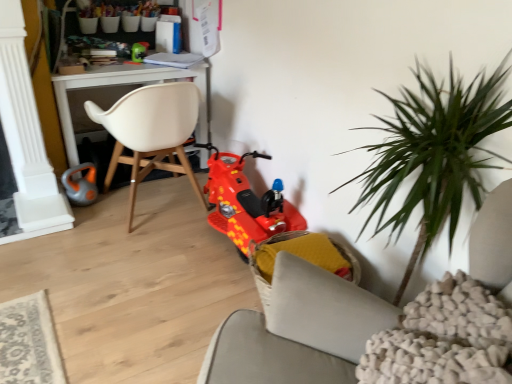
Image resolution: width=512 pixels, height=384 pixels. Find the location of `free space in front of orange rubber toy at lower left, placed as the 2th toy when sorted from top to bottom`. free space in front of orange rubber toy at lower left, placed as the 2th toy when sorted from top to bottom is located at coordinates (89, 216).